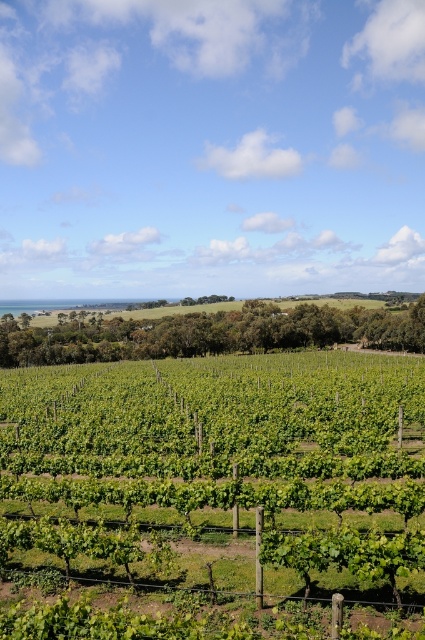
Can you confirm if green leafy vines at center is thinner than green grassy hillside at center?

Yes, green leafy vines at center is thinner than green grassy hillside at center.

From the picture: Does green leafy vines at center appear over green grassy hillside at center?

No.

Which is in front, point (119, 410) or point (147, 314)?

Point (119, 410) is in front.

This screenshot has height=640, width=425. Identify the location of green leafy vines at center. (209, 492).